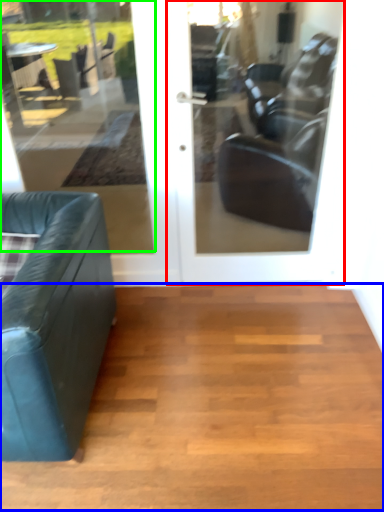
Question: Which is farther away from door (highlighted by a red box)? hardwood (highlighted by a blue box) or window (highlighted by a green box)?

Choices:
 (A) hardwood
 (B) window

Answer: (B)